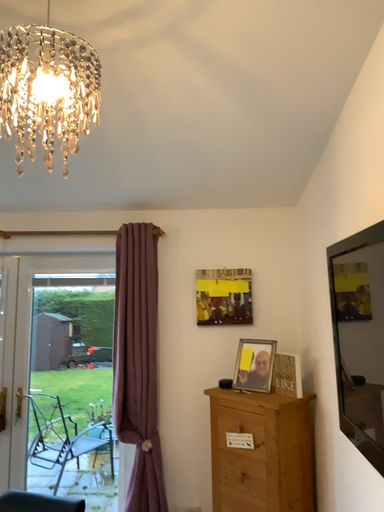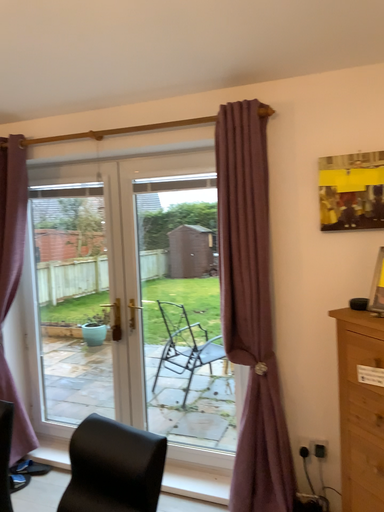
Question: How did the camera likely rotate when shooting the video?

Choices:
 (A) rotated left
 (B) rotated right

Answer: (A)